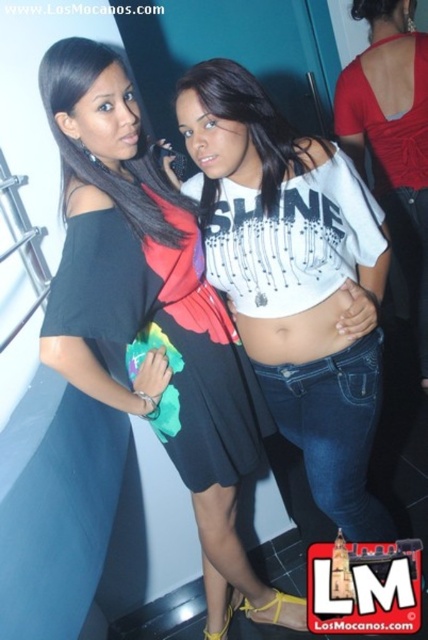
Question: Among these points, which one is farthest from the camera?

Choices:
 (A) (250, 349)
 (B) (121, 188)

Answer: (A)

Question: Which object is the closest to the white matte skin at center?

Choices:
 (A) matte black dress at center
 (B) black matte dress at center

Answer: (B)

Question: Which object is positioned farthest from the matte black dress at center?

Choices:
 (A) black matte dress at center
 (B) white matte skin at center

Answer: (B)

Question: Can you confirm if black matte dress at center is wider than matte black dress at center?

Choices:
 (A) yes
 (B) no

Answer: (A)

Question: Does black matte dress at center appear over matte black dress at center?

Choices:
 (A) yes
 (B) no

Answer: (B)

Question: Is black matte dress at center above white matte skin at center?

Choices:
 (A) no
 (B) yes

Answer: (A)